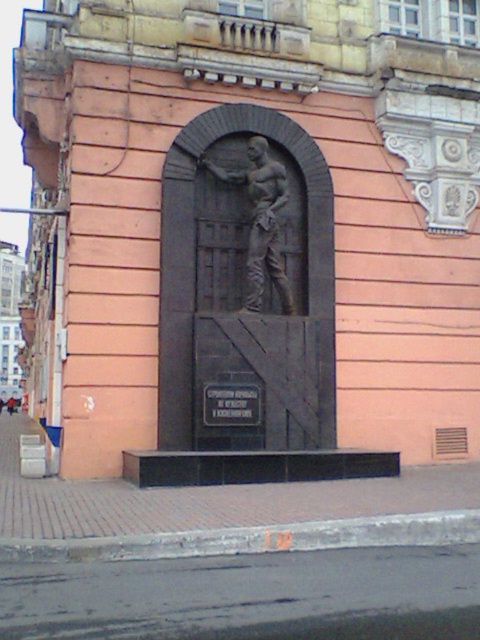
Does black stone relief at center appear under gray stone statue at center?

Correct, black stone relief at center is located below gray stone statue at center.

Is black stone relief at center closer to the viewer compared to gray stone statue at center?

That is True.

Find the location of a particular element. This screenshot has width=480, height=640. black stone relief at center is located at coordinates (247, 280).

Who is positioned more to the right, black stone relief at center or black metal plaque at center?

From the viewer's perspective, black stone relief at center appears more on the right side.

Does black stone relief at center have a larger size compared to black metal plaque at center?

Yes, black stone relief at center is bigger than black metal plaque at center.

This screenshot has width=480, height=640. Identify the location of black stone relief at center. (247, 280).

Locate an element on the screen. This screenshot has width=480, height=640. gray stone statue at center is located at coordinates (261, 220).

Does gray stone statue at center have a larger size compared to black metal plaque at center?

Indeed, gray stone statue at center has a larger size compared to black metal plaque at center.

The width and height of the screenshot is (480, 640). What are the coordinates of `gray stone statue at center` in the screenshot? It's located at (261, 220).

Locate an element on the screen. Image resolution: width=480 pixels, height=640 pixels. gray stone statue at center is located at coordinates (261, 220).